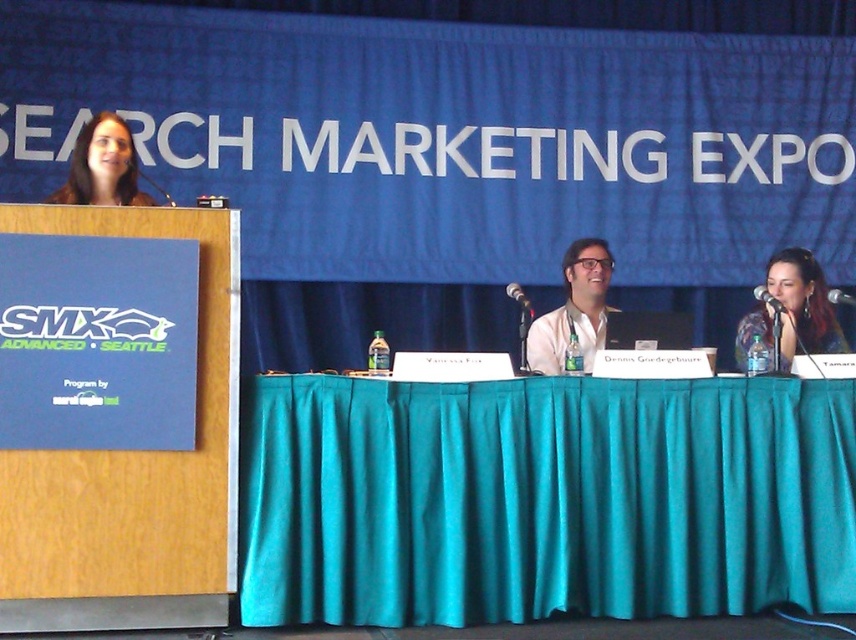
Question: Is blonde hair at upper left to the right of metallic silver microphone at center from the viewer's perspective?

Choices:
 (A) yes
 (B) no

Answer: (B)

Question: Considering the real-world distances, which object is closest to the teal fabric table at center?

Choices:
 (A) matte black microphone at right
 (B) black plastic microphone at center
 (C) blonde hair at upper left
 (D) black plastic microphone at right

Answer: (A)

Question: Among these objects, which one is farthest from the camera?

Choices:
 (A) blonde hair at upper left
 (B) teal fabric table at center

Answer: (A)

Question: Where is matte black microphone at right located in relation to blonde hair at upper left in the image?

Choices:
 (A) right
 (B) left

Answer: (A)

Question: Does blonde hair at upper left appear on the right side of black plastic microphone at center?

Choices:
 (A) no
 (B) yes

Answer: (A)

Question: Which object is the closest to the teal fabric table at center?

Choices:
 (A) metallic silver microphone at center
 (B) blonde hair at upper left
 (C) black plastic microphone at right
 (D) matte black microphone at right

Answer: (D)